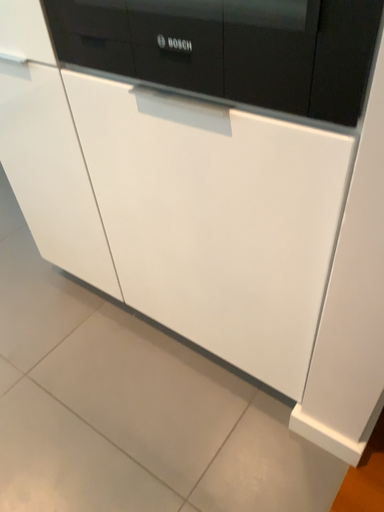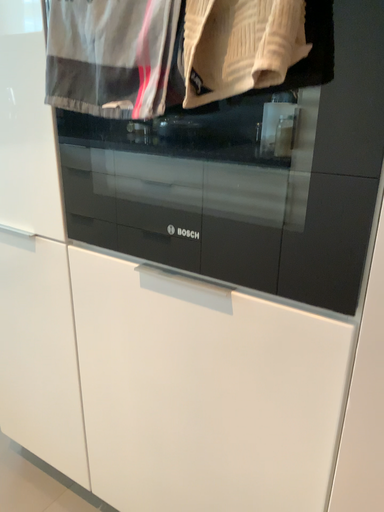
Question: Which way did the camera rotate in the video?

Choices:
 (A) rotated downward
 (B) rotated upward

Answer: (B)